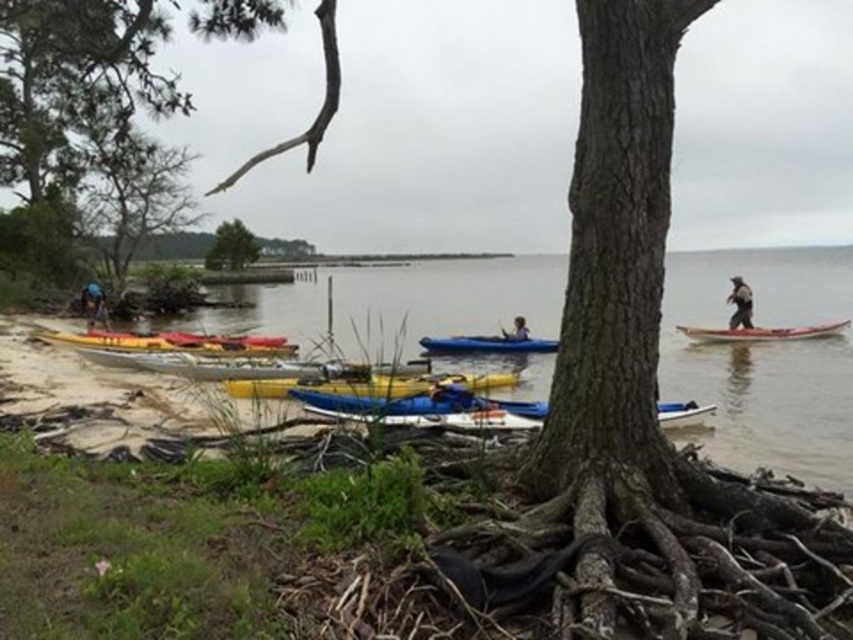
You are a photographer trying to capture a clear shot of the smooth pink kayak at right and the dark gray fabric at right. Given that your camera has a minimum focus distance of 1 meter, can you focus on both objects simultaneously without moving closer?

The smooth pink kayak at right and dark gray fabric at right are 1.04 meters apart from each other. Since the distance between them is slightly more than 1 meter, the camera can focus on both objects simultaneously as the minimum focus distance requirement is met.

You are standing at the point labeled point (70, 60) and want to walk to the point labeled point (91, 305). Given the tree with exposed roots blocking part of the view, will you have a clear path to walk directly to your destination?

Since point (70, 60) is in front of point (91, 305), you will have to walk behind the tree with exposed roots to reach your destination, so the path is not clear.

You are standing on the sandy shore and see the smooth pink kayak at right and the dark gray fabric at right. Which object is closer to the water?

The smooth pink kayak at right is closer to the water because it is positioned to the right of the dark gray fabric at right, indicating it is further away from the shore.